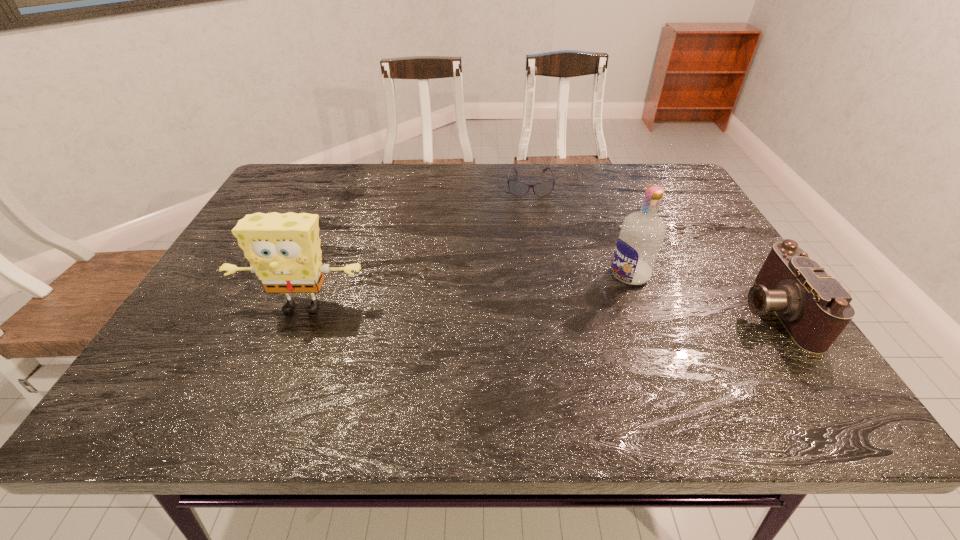
Find the location of `vacant area that satisfies the following two spatial constraints: 1. on the front side of the camera; 2. on the front-facing side of the second object from left to right`. vacant area that satisfies the following two spatial constraints: 1. on the front side of the camera; 2. on the front-facing side of the second object from left to right is located at coordinates (550, 311).

This screenshot has width=960, height=540. Identify the location of free space that satisfies the following two spatial constraints: 1. on the front side of the farthest object; 2. on the left side of the second object from right to left. (544, 274).

Identify the location of free space in the image that satisfies the following two spatial constraints: 1. on the front side of the camera; 2. on the front-facing side of the third object from left to right. (644, 311).

Identify the location of vacant space that satisfies the following two spatial constraints: 1. on the front side of the farthest object; 2. on the right side of the vodka. (544, 274).

Where is `free space in the image that satisfies the following two spatial constraints: 1. on the front side of the vodka; 2. on the right side of the farthest object`? This screenshot has width=960, height=540. free space in the image that satisfies the following two spatial constraints: 1. on the front side of the vodka; 2. on the right side of the farthest object is located at coordinates (544, 274).